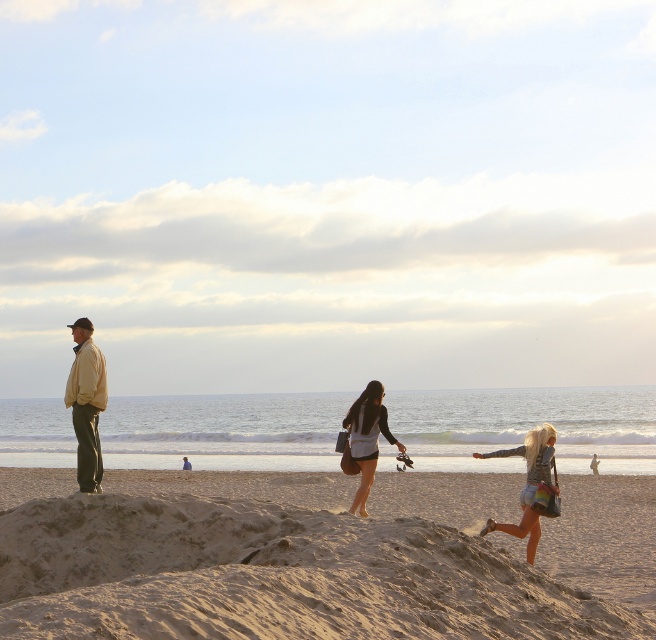
You are a photographer planning to capture the beach scene. You want to ensure the beige sandy mound at center and the denim shorts at lower right are both visible in the frame. Given their sizes, which object should you position closer to the camera to maintain their visibility?

The beige sandy mound at center is larger than the denim shorts at lower right. To ensure both are visible, position the beige sandy mound at center farther from the camera and the denim shorts at lower right closer. This way, the larger mound remains in the background while the smaller shorts are nearer, balancing their sizes in the frame.

You are a photographer trying to capture the denim shorts at lower right and the matte yellow jacket at left in the same frame. Based on their positions, which object should you focus on first to ensure both are in the frame?

The matte yellow jacket at left is above denim shorts at lower right, so you should focus on the denim shorts at lower right first to ensure both are in the frame.

You are planning to build a sandcastle on the beach. You have two options for locations where the beige sandy mound at center and the denim shorts at lower right are. Which location would provide a more stable base for the sandcastle, and why?

The beige sandy mound at center would provide a more stable base for the sandcastle because its width is larger than the denim shorts at lower right, offering a wider and more solid foundation.